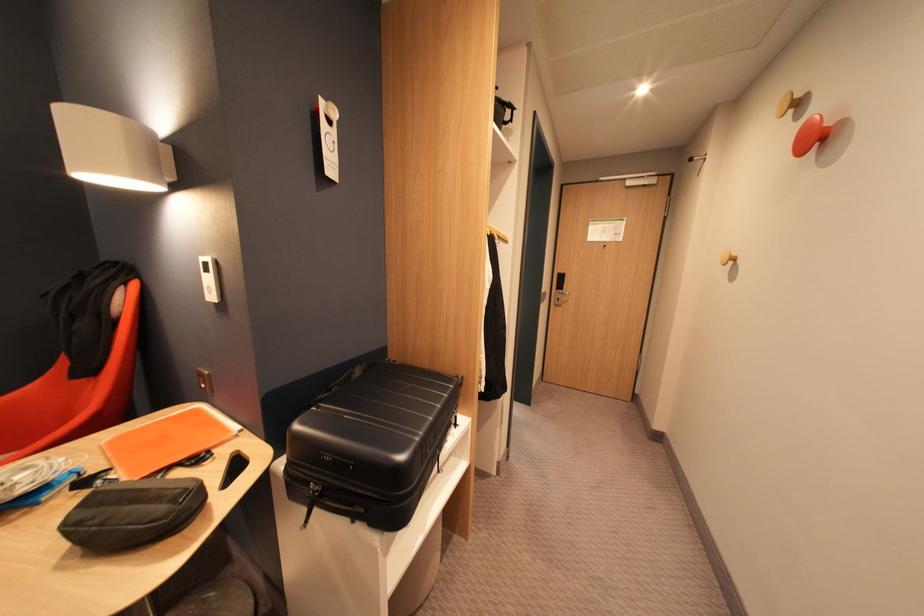
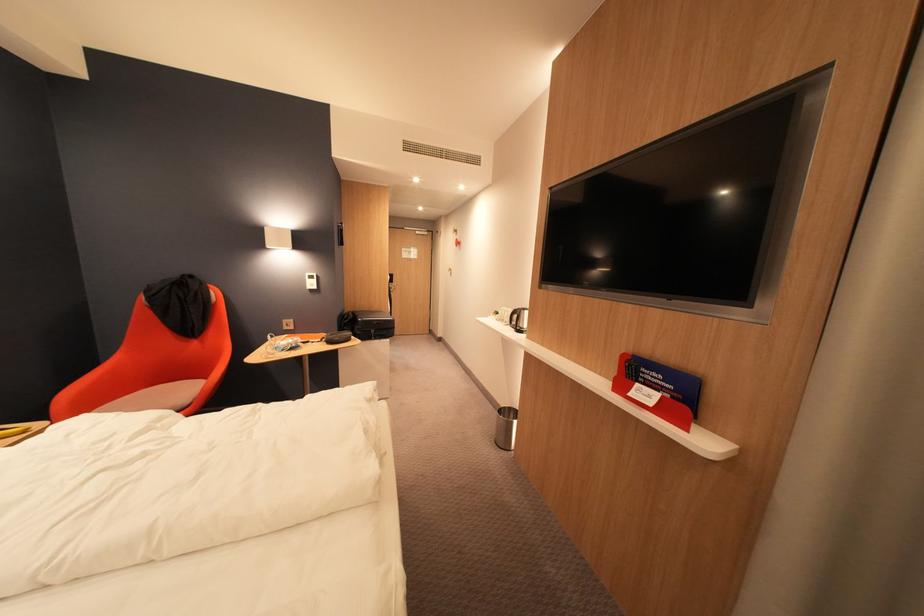
In the second image, find the point that corresponds to the point at 306,427 in the first image.

(370, 321)